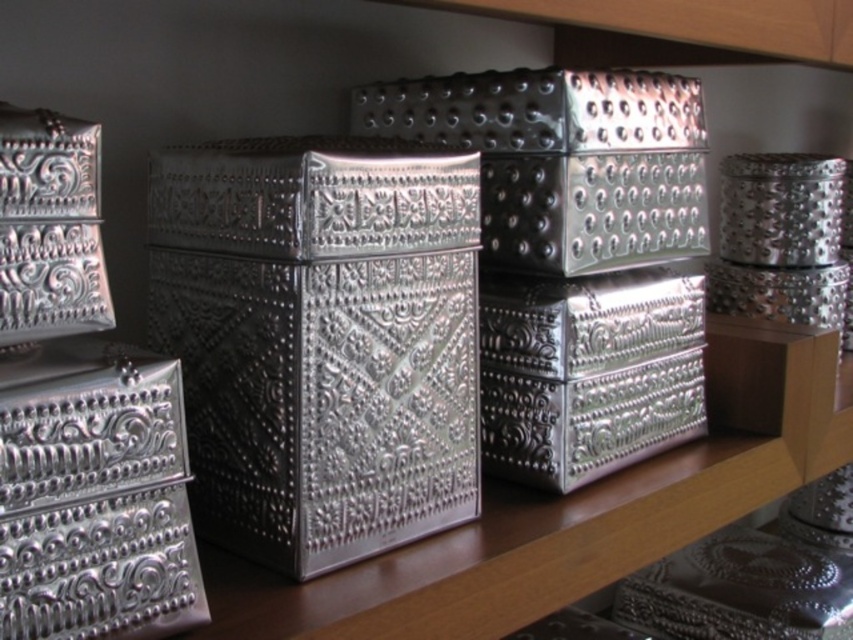
Question: Can you confirm if silver textured box at left is bigger than metallic textured box at center?

Choices:
 (A) yes
 (B) no

Answer: (B)

Question: Which point appears farthest from the camera in this image?

Choices:
 (A) 196,218
 (B) 665,602
 (C) 62,196
 (D) 204,602

Answer: (B)

Question: Is metallic silver textured box at center to the right of silver textured box at center from the viewer's perspective?

Choices:
 (A) no
 (B) yes

Answer: (B)

Question: Does silver textured box at center appear under silver textured box at left?

Choices:
 (A) no
 (B) yes

Answer: (B)

Question: Based on their relative distances, which object is farther from the silver textured box at center?

Choices:
 (A) metallic silver textured box at center
 (B) silver textured box at left
 (C) metallic textured box at center

Answer: (C)

Question: Which point is farther to the camera?

Choices:
 (A) (358, 348)
 (B) (102, 368)

Answer: (A)